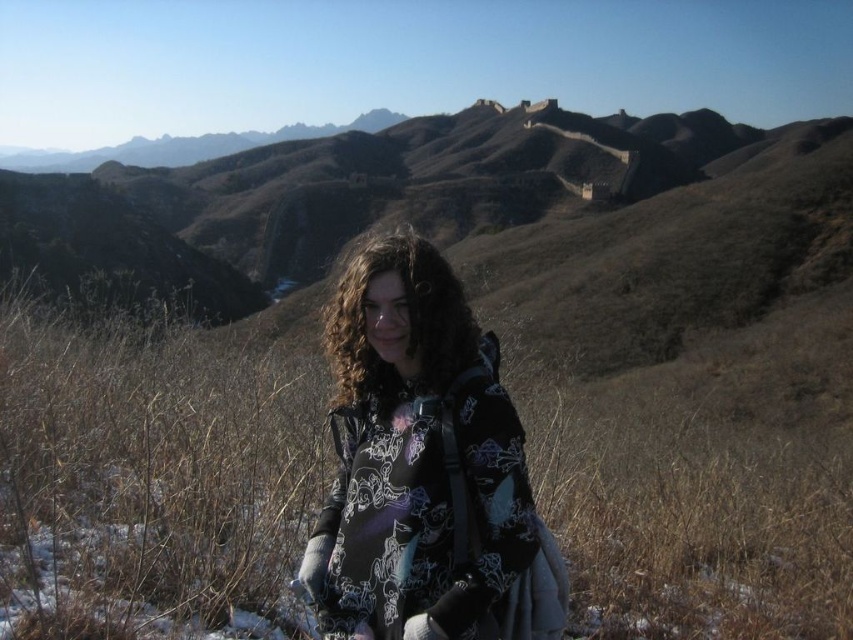
Question: Among these objects, which one is farthest from the camera?

Choices:
 (A) brown dry grass at center
 (B) black printed hoodie at center

Answer: (B)

Question: Among these objects, which one is farthest from the camera?

Choices:
 (A) brown dry grass at center
 (B) black printed hoodie at center

Answer: (B)

Question: Is brown dry grass at center further to camera compared to black printed hoodie at center?

Choices:
 (A) no
 (B) yes

Answer: (A)

Question: Does brown dry grass at center have a smaller size compared to black printed hoodie at center?

Choices:
 (A) yes
 (B) no

Answer: (B)

Question: Which point is farther from the camera taking this photo?

Choices:
 (A) pos(228,628)
 (B) pos(462,419)

Answer: (B)

Question: Where is brown dry grass at center located in relation to black printed hoodie at center in the image?

Choices:
 (A) right
 (B) left

Answer: (A)